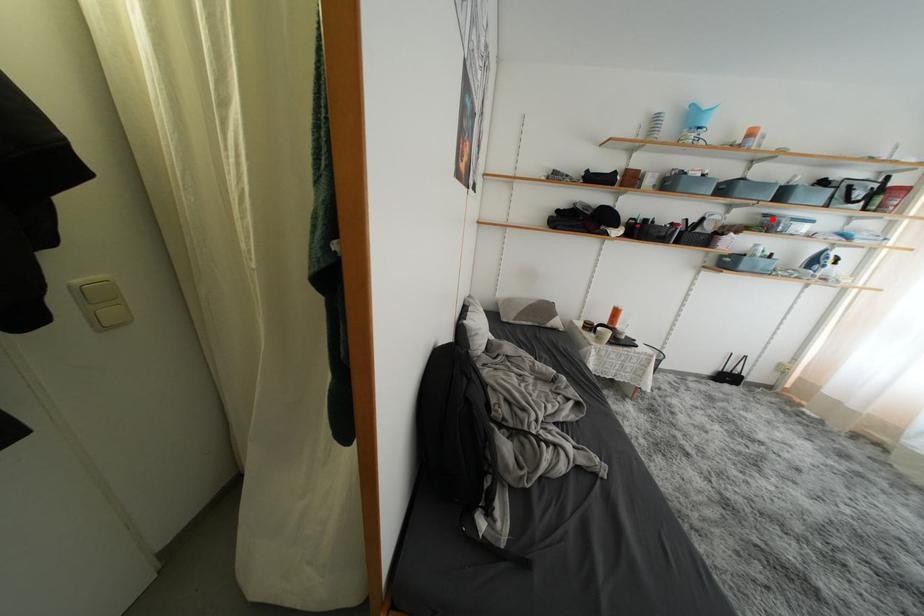
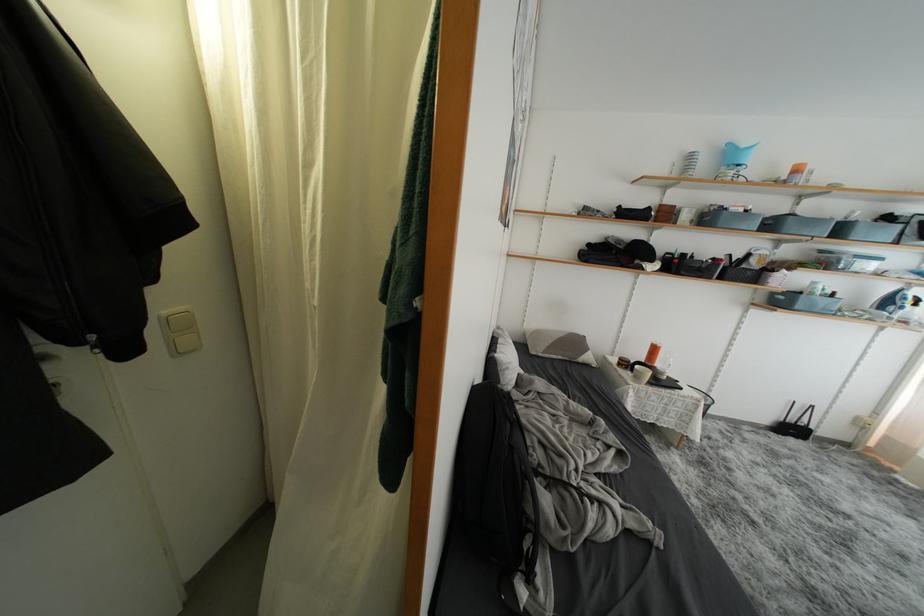
Locate, in the second image, the point that corresponds to the highlighted location in the first image.

(829, 256)